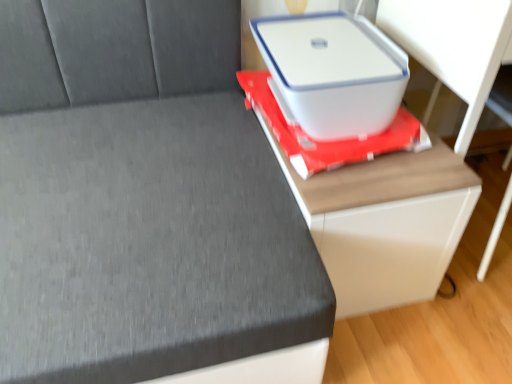
Question: Should I look upward or downward to see white glossy table at center?

Choices:
 (A) down
 (B) up

Answer: (B)

Question: Considering the relative sizes of white plastic storage box at upper right and white matte computer desk at right in the image provided, is white plastic storage box at upper right taller than white matte computer desk at right?

Choices:
 (A) yes
 (B) no

Answer: (B)

Question: Is white plastic storage box at upper right facing towards white matte computer desk at right?

Choices:
 (A) yes
 (B) no

Answer: (B)

Question: Would you consider white plastic storage box at upper right to be distant from white matte computer desk at right?

Choices:
 (A) yes
 (B) no

Answer: (B)

Question: Can you confirm if white plastic storage box at upper right is bigger than white matte computer desk at right?

Choices:
 (A) no
 (B) yes

Answer: (A)

Question: From a real-world perspective, is white plastic storage box at upper right over white matte computer desk at right?

Choices:
 (A) yes
 (B) no

Answer: (A)

Question: Is white plastic storage box at upper right thinner than white matte computer desk at right?

Choices:
 (A) yes
 (B) no

Answer: (A)

Question: Is white plastic container at upper right positioned far away from white glossy table at center?

Choices:
 (A) yes
 (B) no

Answer: (B)

Question: Could white glossy table at center be considered to be inside white plastic container at upper right?

Choices:
 (A) yes
 (B) no

Answer: (B)

Question: From the image's perspective, is white plastic container at upper right located beneath white glossy table at center?

Choices:
 (A) yes
 (B) no

Answer: (A)

Question: Considering the relative positions of white plastic container at upper right and white glossy table at center in the image provided, is white plastic container at upper right behind white glossy table at center?

Choices:
 (A) no
 (B) yes

Answer: (A)

Question: Considering the relative positions of white plastic container at upper right and white glossy table at center in the image provided, is white plastic container at upper right to the right of white glossy table at center from the viewer's perspective?

Choices:
 (A) no
 (B) yes

Answer: (A)

Question: Is white plastic container at upper right smaller than white glossy table at center?

Choices:
 (A) no
 (B) yes

Answer: (A)

Question: Does white matte computer desk at right turn towards white glossy table at center?

Choices:
 (A) no
 (B) yes

Answer: (A)